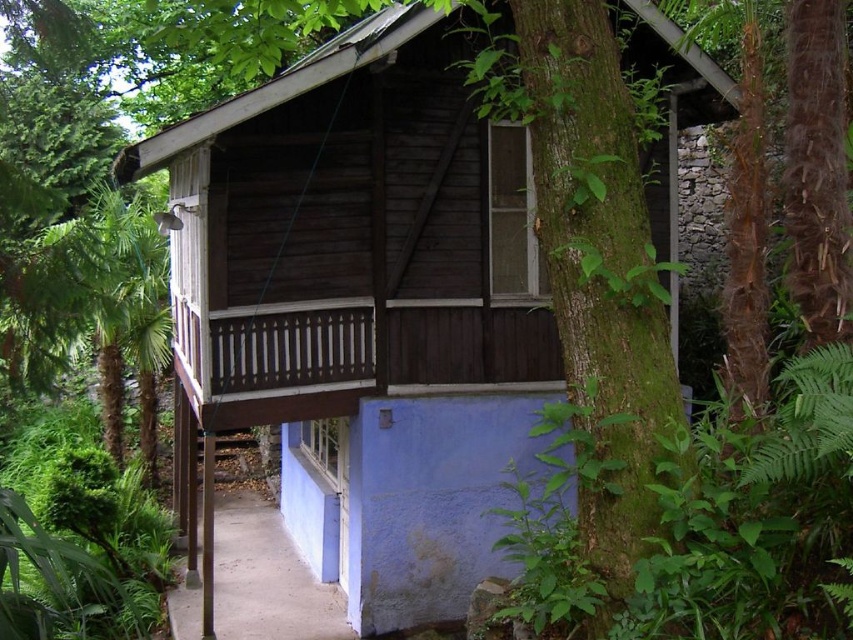
You are planning to build a garden shed in your backyard. You have a wooden cabin at center and a brown concrete path at lower center in the image. Which one occupies more space in the scene?

The wooden cabin at center is bigger than the brown concrete path at lower center, so it occupies more space in the scene.

You are standing in front of the wooden cabin at center and want to take a photo of it. There is a green leafy tree at left nearby. Since you want the cabin to dominate the photo, which object should be placed closer to the camera to achieve this effect?

To make the wooden cabin at center dominate the photo, you should place the wooden cabin at center closer to the camera. Since the wooden cabin at center is taller than the green leafy tree at left, positioning it closer will emphasize its size and prominence in the image.